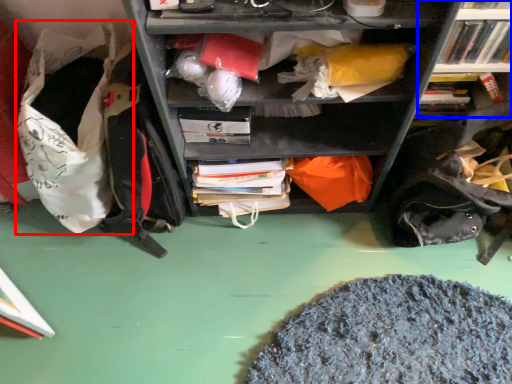
Question: Which point is further to the camera, bean bag chair (highlighted by a red box) or bookcase (highlighted by a blue box)?

Choices:
 (A) bean bag chair
 (B) bookcase

Answer: (B)